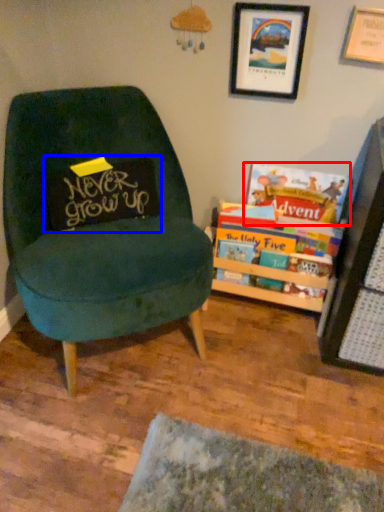
Question: Which of the following is the farthest to the observer, book (highlighted by a red box) or pillow (highlighted by a blue box)?

Choices:
 (A) book
 (B) pillow

Answer: (A)